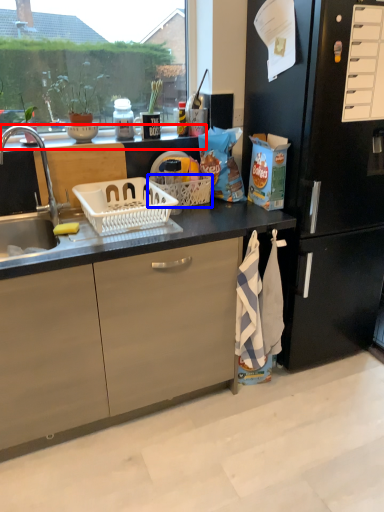
Question: Which of the following is the closest to the observer, window sill (highlighted by a red box) or picnic basket (highlighted by a blue box)?

Choices:
 (A) window sill
 (B) picnic basket

Answer: (A)